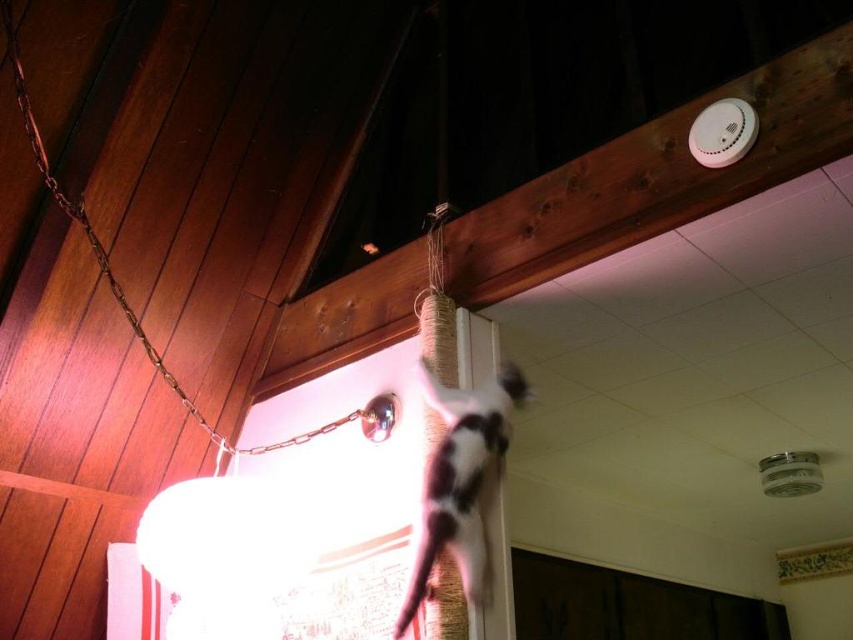
Is white fur cat at upper center closer to the viewer compared to metallic chain at upper left?

Yes, white fur cat at upper center is closer to the viewer.

Looking at this image, who is positioned more to the right, white fur cat at upper center or metallic chain at upper left?

white fur cat at upper center is more to the right.

Between point (434, 508) and point (234, 451), which one is positioned in front?

Point (434, 508) is in front.

Where is `white fur cat at upper center`? This screenshot has width=853, height=640. white fur cat at upper center is located at coordinates tap(459, 481).